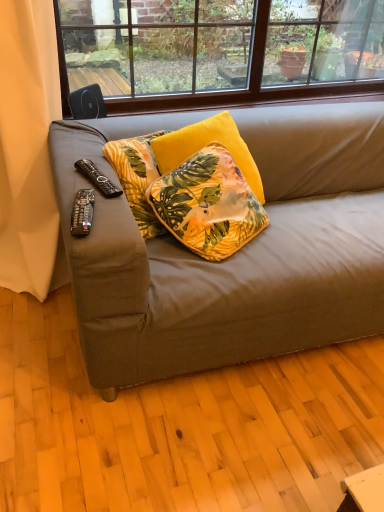
Find the location of a particular element. The width and height of the screenshot is (384, 512). space that is in front of black plastic remote at left, which appears as the 2th remote control when ordered from the bottom is located at coordinates (99, 207).